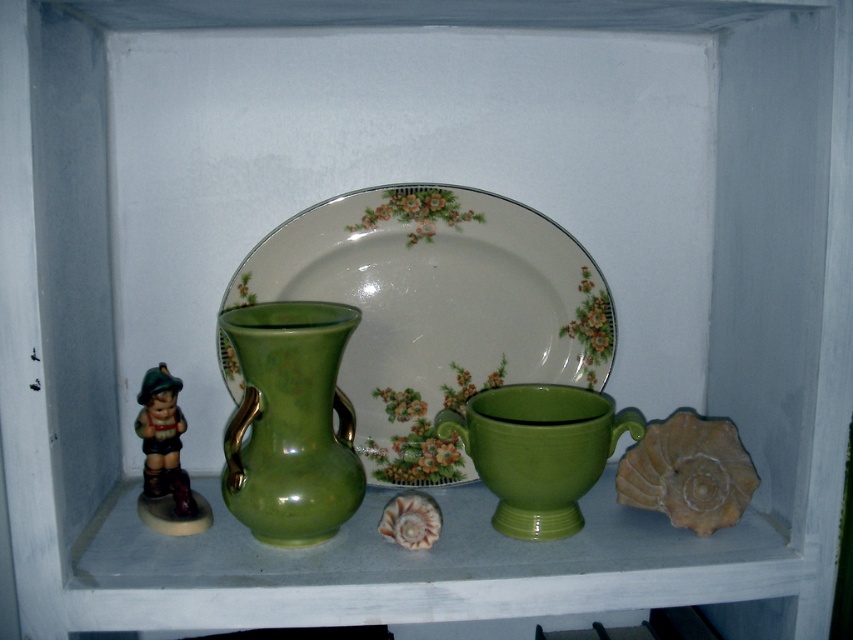
Question: Is porcelain floral platter at center thinner than green glossy vase at center?

Choices:
 (A) no
 (B) yes

Answer: (A)

Question: Is green glossy vase at center bigger than matte ceramic figurine at left?

Choices:
 (A) no
 (B) yes

Answer: (B)

Question: Which of the following is the farthest from the observer?

Choices:
 (A) (170, 467)
 (B) (555, 304)
 (C) (314, 506)

Answer: (B)

Question: Is porcelain floral platter at center smaller than green glossy vase at center?

Choices:
 (A) no
 (B) yes

Answer: (A)

Question: Which point is closer to the camera?

Choices:
 (A) porcelain floral platter at center
 (B) matte ceramic figurine at left
 (C) green glossy vase at center

Answer: (C)

Question: Which object is closer to the camera taking this photo?

Choices:
 (A) green glossy vase at center
 (B) porcelain floral platter at center

Answer: (A)